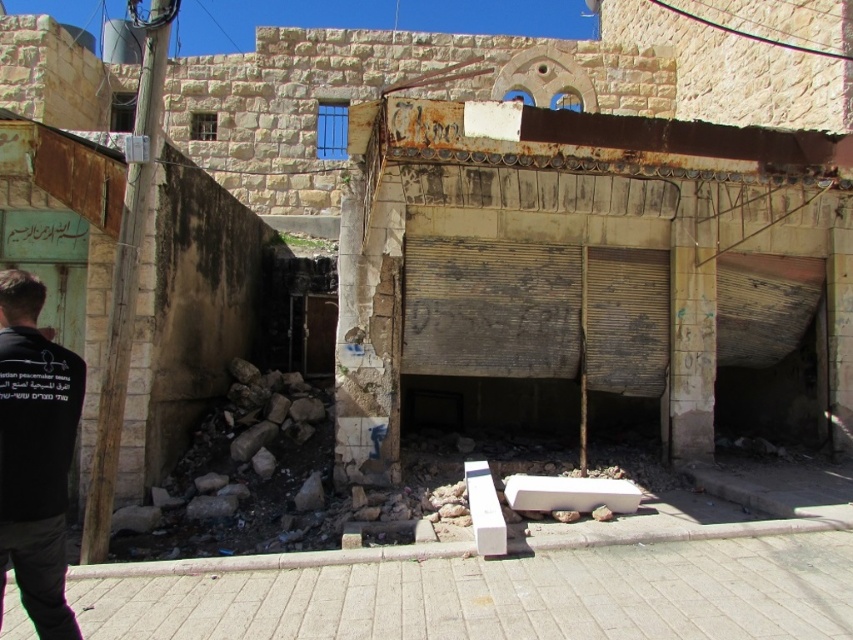
Image resolution: width=853 pixels, height=640 pixels. Find the location of `white concrete wall at lower center`. white concrete wall at lower center is located at coordinates (503, 596).

Is point (674, 592) closer to viewer compared to point (53, 480)?

No.

Identify the location of white concrete wall at lower center. The width and height of the screenshot is (853, 640). (503, 596).